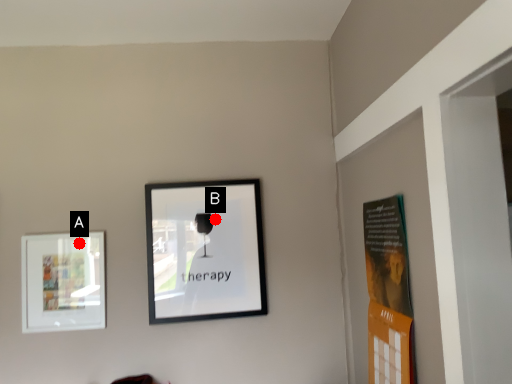
Question: Two points are circled on the image, labeled by A and B beside each circle. Among these points, which one is farthest from the camera?

Choices:
 (A) A is further
 (B) B is further

Answer: (B)